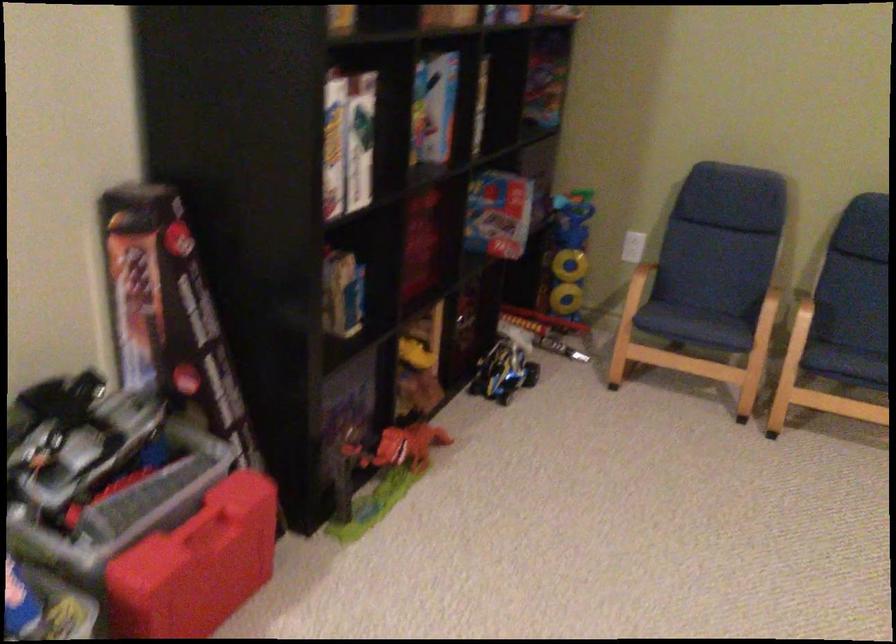
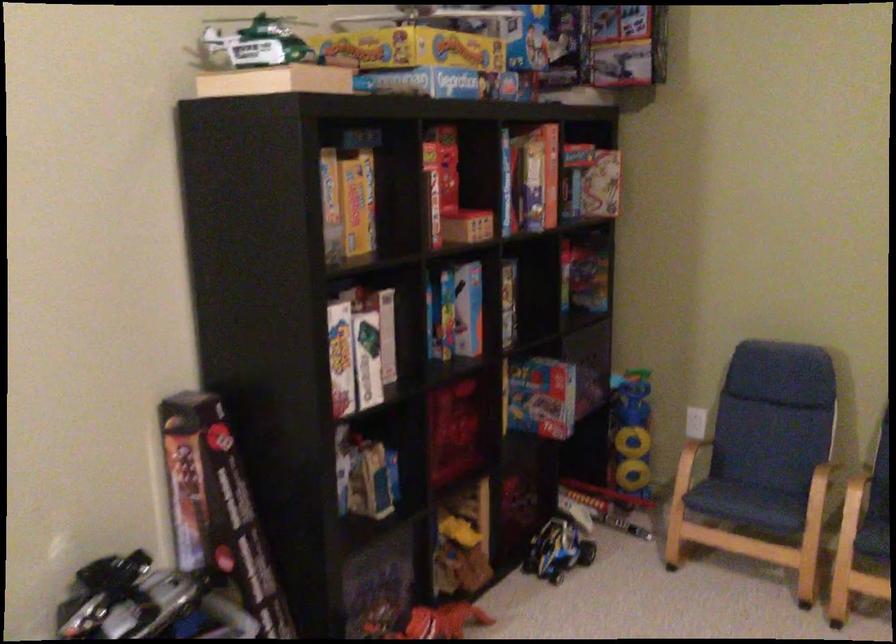
The point at (633, 288) is marked in the first image. Where is the corresponding point in the second image?

(683, 466)